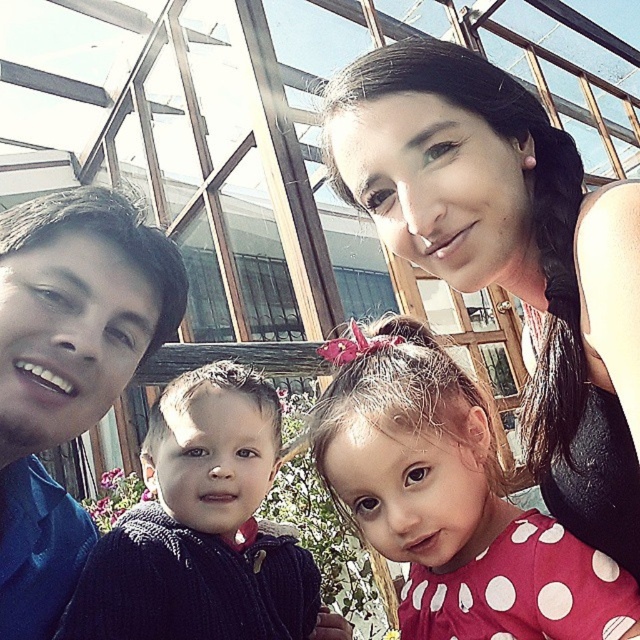
In the family selfie, the blue shirt at left and the dark blue corduroy sweater at left are both worn by the man on the left. Which clothing item is higher on his body?

The blue shirt at left is above the dark blue corduroy sweater at left, so the blue shirt at left is higher on the man.

You are standing at the center of the image and want to reach the two points labeled as point (x=464, y=557) and point (x=234, y=570). Which point should you walk towards first to reach the one closer to you?

Point (x=464, y=557) is in front of point (x=234, y=570), so you should walk towards point (x=464, y=557) first since it is closer to you.